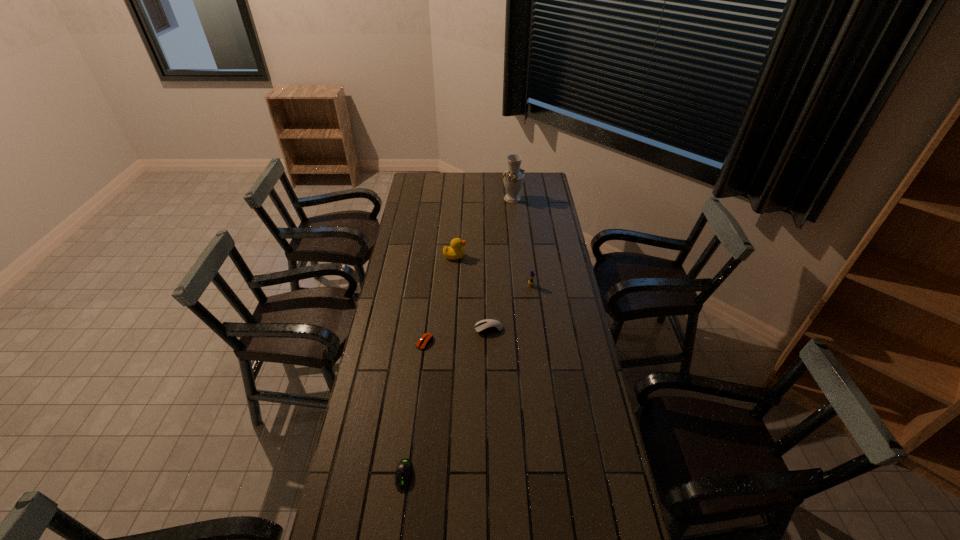
Image resolution: width=960 pixels, height=540 pixels. Find the location of `the shortest computer mouse`. the shortest computer mouse is located at coordinates (426, 339).

Image resolution: width=960 pixels, height=540 pixels. I want to click on free location located on the left of the vase, so click(459, 199).

Locate an element on the screen. This screenshot has width=960, height=540. vacant position located at the beak of the fifth shortest object is located at coordinates (499, 256).

Find the location of `vacant area situated on the face of the fourth shortest object, where the monocle is placed`. vacant area situated on the face of the fourth shortest object, where the monocle is placed is located at coordinates (538, 346).

Image resolution: width=960 pixels, height=540 pixels. I want to click on vacant region located 0.110m on the right of the rightmost computer mouse, so click(530, 329).

The height and width of the screenshot is (540, 960). In order to click on free region located 0.060m on the wheel side of the second shortest computer mouse in this screenshot , I will do (399, 513).

Where is `free space located 0.270m on the right of the shortest object`? free space located 0.270m on the right of the shortest object is located at coordinates (502, 342).

At what (x,y) coordinates should I click in order to perform the action: click on object at the far edge. Please return your answer as a coordinate pair (x, y). Looking at the image, I should click on (513, 178).

Locate an element on the screen. object that is positioned at the left edge is located at coordinates (404, 471).

In the image, there is a desktop. Where is `free space at the left edge`? This screenshot has width=960, height=540. free space at the left edge is located at coordinates (408, 217).